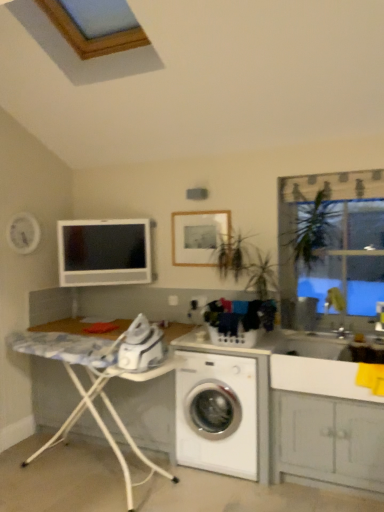
Question: Is white glossy sink at lower right, acting as the 1th sink starting from the bottom, aimed at white painted wood cabinet at lower right?

Choices:
 (A) no
 (B) yes

Answer: (B)

Question: Is white glossy sink at lower right, acting as the 1th sink starting from the bottom, bigger than white painted wood cabinet at lower right?

Choices:
 (A) no
 (B) yes

Answer: (A)

Question: Can you confirm if white glossy sink at lower right, positioned as the 2th sink in top-to-bottom order, is positioned to the right of white painted wood cabinet at lower right?

Choices:
 (A) no
 (B) yes

Answer: (B)

Question: Can you confirm if white glossy sink at lower right, acting as the 1th sink starting from the bottom, is shorter than white painted wood cabinet at lower right?

Choices:
 (A) no
 (B) yes

Answer: (B)

Question: From the image's perspective, is white glossy sink at lower right, positioned as the 2th sink in top-to-bottom order, under white painted wood cabinet at lower right?

Choices:
 (A) yes
 (B) no

Answer: (B)

Question: Is white glossy sink at lower right, positioned as the 2th sink in top-to-bottom order, in front of white painted wood cabinet at lower right?

Choices:
 (A) yes
 (B) no

Answer: (A)

Question: From the image's perspective, is matte white computer monitor at upper left located above matte wooden picture frame at upper center?

Choices:
 (A) no
 (B) yes

Answer: (A)

Question: Can you confirm if matte white computer monitor at upper left is thinner than matte wooden picture frame at upper center?

Choices:
 (A) yes
 (B) no

Answer: (B)

Question: Is matte white computer monitor at upper left further to the viewer compared to matte wooden picture frame at upper center?

Choices:
 (A) yes
 (B) no

Answer: (A)

Question: Can you confirm if matte white computer monitor at upper left is shorter than matte wooden picture frame at upper center?

Choices:
 (A) no
 (B) yes

Answer: (A)

Question: From a real-world perspective, is matte white computer monitor at upper left located higher than matte wooden picture frame at upper center?

Choices:
 (A) yes
 (B) no

Answer: (B)

Question: Would you say matte wooden picture frame at upper center is part of matte white computer monitor at upper left's contents?

Choices:
 (A) no
 (B) yes

Answer: (A)

Question: Is white painted wood cabinet at lower right bigger than matte white computer monitor at upper left?

Choices:
 (A) yes
 (B) no

Answer: (A)